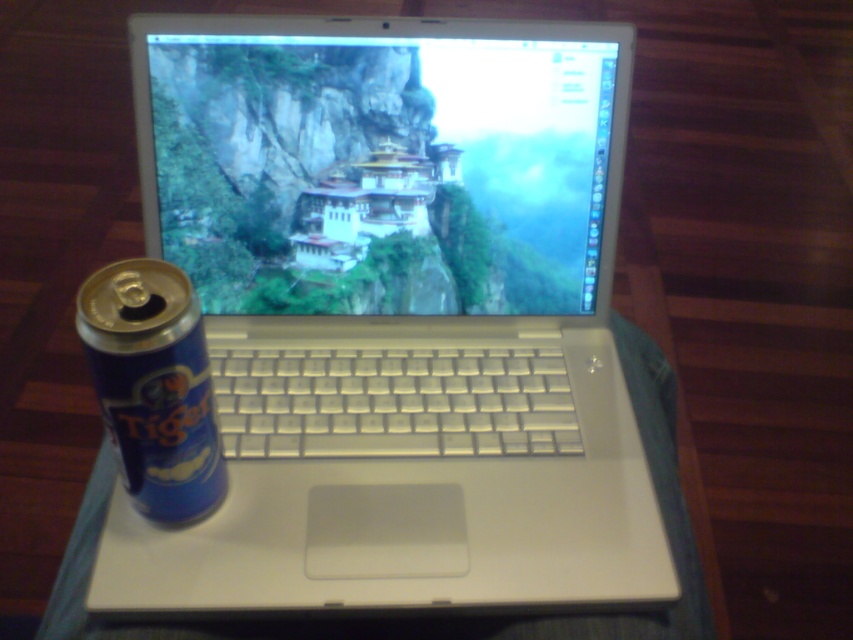
Question: Among these objects, which one is nearest to the camera?

Choices:
 (A) white plastic laptop at center
 (B) metallic silver laptop at center
 (C) blue metallic can at left

Answer: (C)

Question: Can you confirm if white plastic laptop at center is bigger than blue metallic can at left?

Choices:
 (A) yes
 (B) no

Answer: (A)

Question: Does white plastic laptop at center appear under blue metallic can at left?

Choices:
 (A) no
 (B) yes

Answer: (A)

Question: Among these objects, which one is farthest from the camera?

Choices:
 (A) blue metallic can at left
 (B) metallic silver laptop at center
 (C) white plastic laptop at center

Answer: (B)

Question: In this image, where is white plastic laptop at center located relative to blue metallic can at left?

Choices:
 (A) below
 (B) above

Answer: (B)

Question: Which object is closer to the camera taking this photo?

Choices:
 (A) white plastic laptop at center
 (B) blue metallic can at left
 (C) metallic silver laptop at center

Answer: (B)